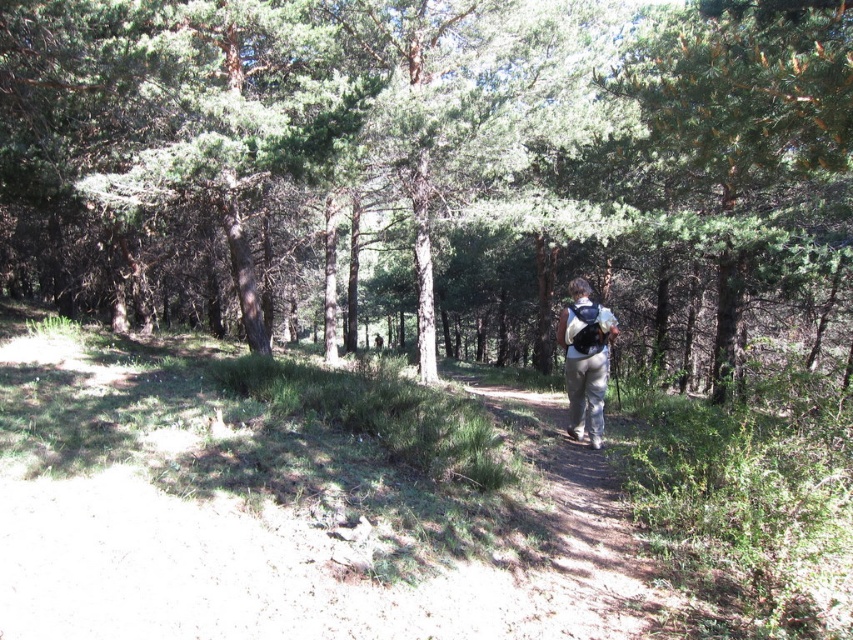
Does green needle-like leaves at upper right have a greater height compared to light gray fabric backpack at center?

Yes.

Is green needle-like leaves at upper right below light gray fabric backpack at center?

Actually, green needle-like leaves at upper right is above light gray fabric backpack at center.

I want to click on green needle-like leaves at upper right, so click(753, 104).

Locate an element on the screen. Image resolution: width=853 pixels, height=640 pixels. green needle-like leaves at upper right is located at coordinates (753, 104).

Which is below, green leafy tree at center or light gray fabric backpack at center?

Positioned lower is light gray fabric backpack at center.

Can you confirm if green leafy tree at center is positioned to the right of light gray fabric backpack at center?

No, green leafy tree at center is not to the right of light gray fabric backpack at center.

Is point (126, 321) farther from viewer compared to point (585, 358)?

Yes, point (126, 321) is farther from viewer.

Identify the location of green leafy tree at center. The width and height of the screenshot is (853, 640). (431, 166).

Based on the photo, which is above, green leafy tree at center or green needle-like leaves at upper right?

green leafy tree at center is above.

Who is positioned more to the right, green leafy tree at center or green needle-like leaves at upper right?

Positioned to the right is green needle-like leaves at upper right.

This screenshot has height=640, width=853. Describe the element at coordinates (431, 166) in the screenshot. I see `green leafy tree at center` at that location.

This screenshot has height=640, width=853. In order to click on green leafy tree at center in this screenshot , I will do `click(431, 166)`.